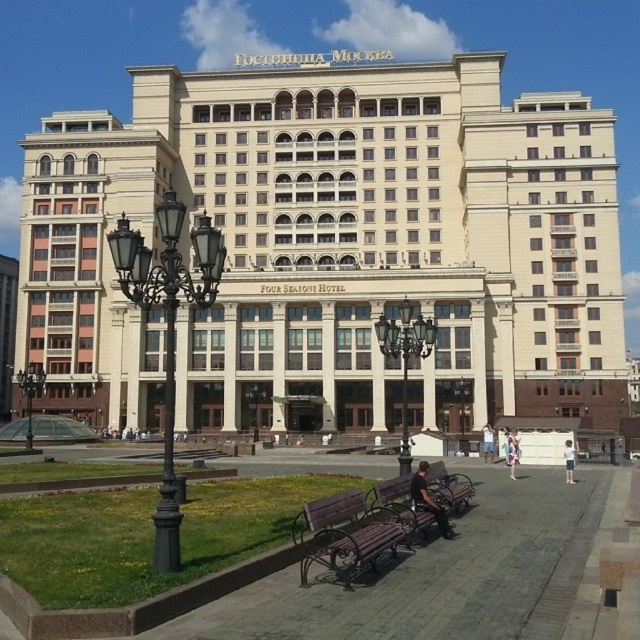
Does wooden park bench at center have a greater height compared to polished brass streetlight at center?

Incorrect, wooden park bench at center's height is not larger of polished brass streetlight at center's.

Measure the distance between wooden park bench at center and camera.

wooden park bench at center and camera are 34.49 meters apart.

Where is `wooden park bench at center`? wooden park bench at center is located at coordinates (344, 534).

Find the location of `wooden park bench at center`. wooden park bench at center is located at coordinates (344, 534).

Who is positioned more to the left, wooden bench at lower center or white cotton shirt at lower center?

From the viewer's perspective, wooden bench at lower center appears more on the left side.

Does wooden bench at lower center have a greater height compared to white cotton shirt at lower center?

Correct, wooden bench at lower center is much taller as white cotton shirt at lower center.

Does point (404, 518) come behind point (564, 464)?

That is False.

Find the location of `wooden bench at lower center`. wooden bench at lower center is located at coordinates (424, 497).

Can you confirm if wooden park bench at center is taller than wooden bench at lower center?

No.

Is wooden park bench at center positioned at the back of wooden bench at lower center?

No, wooden park bench at center is closer to the viewer.

Is point (390, 525) closer to camera compared to point (422, 472)?

Yes.

I want to click on wooden park bench at center, so click(x=344, y=534).